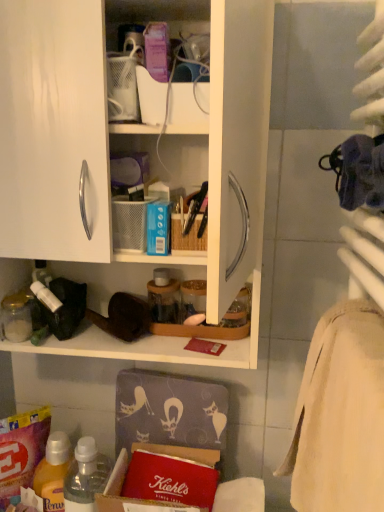
Question: Can you confirm if translucent plastic bottle at lower left is thinner than white matte cabinet at upper left?

Choices:
 (A) no
 (B) yes

Answer: (B)

Question: Is translucent plastic bottle at lower left further to the viewer compared to white matte cabinet at upper left?

Choices:
 (A) no
 (B) yes

Answer: (B)

Question: From the image's perspective, is translucent plastic bottle at lower left above white matte cabinet at upper left?

Choices:
 (A) yes
 (B) no

Answer: (B)

Question: Does translucent plastic bottle at lower left have a lesser height compared to white matte cabinet at upper left?

Choices:
 (A) no
 (B) yes

Answer: (B)

Question: Is translucent plastic bottle at lower left located outside white matte cabinet at upper left?

Choices:
 (A) no
 (B) yes

Answer: (B)

Question: Is translucent plastic bottle at lower left facing towards white matte cabinet at upper left?

Choices:
 (A) no
 (B) yes

Answer: (A)

Question: Considering the relative positions of translucent plastic bottle at lower left and matte plastic container at upper center in the image provided, is translucent plastic bottle at lower left to the left of matte plastic container at upper center from the viewer's perspective?

Choices:
 (A) yes
 (B) no

Answer: (A)

Question: Does translucent plastic bottle at lower left have a lesser width compared to matte plastic container at upper center?

Choices:
 (A) yes
 (B) no

Answer: (B)

Question: From the image's perspective, is translucent plastic bottle at lower left over matte plastic container at upper center?

Choices:
 (A) no
 (B) yes

Answer: (A)

Question: Considering the relative sizes of translucent plastic bottle at lower left and matte plastic container at upper center in the image provided, is translucent plastic bottle at lower left shorter than matte plastic container at upper center?

Choices:
 (A) no
 (B) yes

Answer: (A)

Question: From the image's perspective, is translucent plastic bottle at lower left under matte plastic container at upper center?

Choices:
 (A) no
 (B) yes

Answer: (B)

Question: Is translucent plastic bottle at lower left not within matte plastic container at upper center?

Choices:
 (A) no
 (B) yes

Answer: (B)

Question: Is beige cotton bath towel at right turned away from translucent plastic bottle at lower left?

Choices:
 (A) no
 (B) yes

Answer: (A)